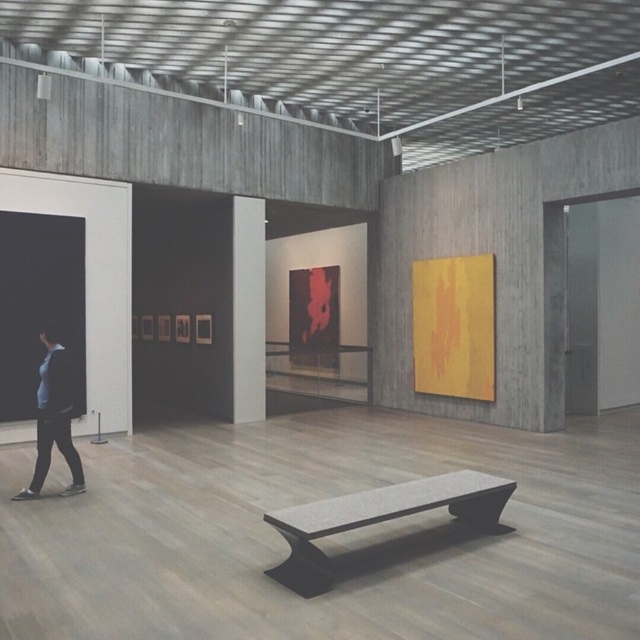
Question: Can you confirm if granite-like bench at center is thinner than dark blue shirt at left?

Choices:
 (A) yes
 (B) no

Answer: (B)

Question: Which point is closer to the camera?

Choices:
 (A) dark blue shirt at left
 (B) granite-like bench at center

Answer: (B)

Question: In this image, where is granite-like bench at center located relative to dark blue shirt at left?

Choices:
 (A) left
 (B) right

Answer: (B)

Question: Can you confirm if granite-like bench at center is positioned above dark blue shirt at left?

Choices:
 (A) no
 (B) yes

Answer: (A)